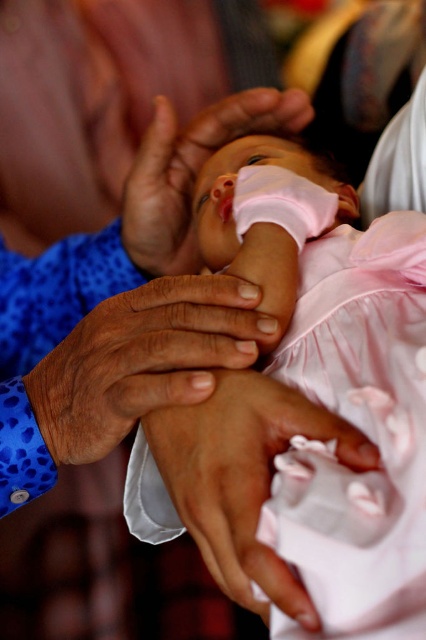
Is pink satin baby hand at center taller than pink fabric at center?

No.

Between pink satin baby hand at center and pink fabric at center, which one is positioned lower?

Positioned lower is pink satin baby hand at center.

Does point (299, 595) lie in front of point (181, 232)?

Yes, it is.

Locate an element on the screen. This screenshot has height=640, width=426. pink satin baby hand at center is located at coordinates (242, 477).

Does smooth skin hand at center have a lesser height compared to pink fabric at center?

Yes.

Is smooth skin hand at center closer to the viewer compared to pink fabric at center?

Yes, smooth skin hand at center is closer to the viewer.

Which is in front, point (189, 385) or point (146, 256)?

Point (189, 385) is more forward.

Find the location of a particular element. The height and width of the screenshot is (640, 426). smooth skin hand at center is located at coordinates (141, 358).

Can you confirm if smooth skin hand at center is positioned to the left of pink satin baby hand at center?

Correct, you'll find smooth skin hand at center to the left of pink satin baby hand at center.

Where is `smooth skin hand at center`? smooth skin hand at center is located at coordinates (141, 358).

This screenshot has height=640, width=426. What are the coordinates of `smooth skin hand at center` in the screenshot? It's located at (141, 358).